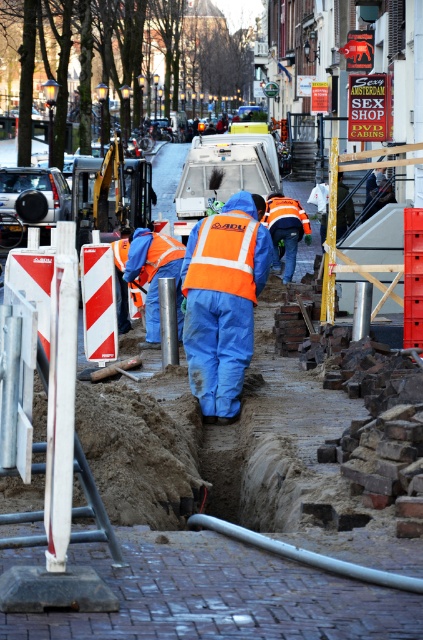
You are a pedestrian walking on the street and see the orange reflective jacket at center and the orange reflective safety vest at center. Which one is positioned more to the left?

The orange reflective jacket at center is positioned more to the left than the orange reflective safety vest at center.

You are a pedestrian walking on the street and see the orange reflective safety vest at center and the reflective orange vest at center. Which one is more to the right?

The orange reflective safety vest at center is positioned on the right side of reflective orange vest at center, so it is more to the right.